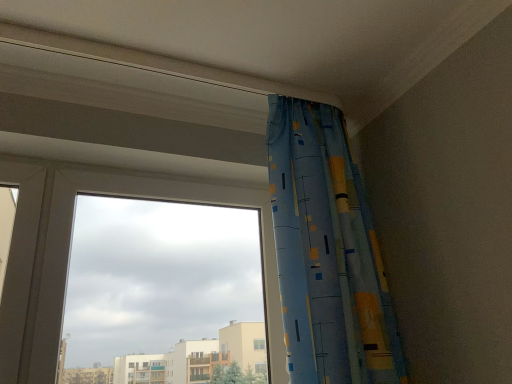
Question: Is blue printed fabric curtain at upper right further to camera compared to transparent glass window at upper left?

Choices:
 (A) no
 (B) yes

Answer: (A)

Question: Does blue printed fabric curtain at upper right have a smaller size compared to transparent glass window at upper left?

Choices:
 (A) yes
 (B) no

Answer: (B)

Question: Is blue printed fabric curtain at upper right oriented away from transparent glass window at upper left?

Choices:
 (A) no
 (B) yes

Answer: (A)

Question: Is transparent glass window at upper left inside blue printed fabric curtain at upper right?

Choices:
 (A) no
 (B) yes

Answer: (A)

Question: Does blue printed fabric curtain at upper right turn towards transparent glass window at upper left?

Choices:
 (A) yes
 (B) no

Answer: (B)

Question: Can you confirm if blue printed fabric curtain at upper right is taller than transparent glass window at upper left?

Choices:
 (A) yes
 (B) no

Answer: (A)

Question: Can you confirm if transparent glass window at upper left is bigger than blue printed fabric curtain at upper right?

Choices:
 (A) no
 (B) yes

Answer: (A)

Question: Would you say transparent glass window at upper left is outside blue printed fabric curtain at upper right?

Choices:
 (A) no
 (B) yes

Answer: (B)

Question: Considering the relative sizes of transparent glass window at upper left and blue printed fabric curtain at upper right in the image provided, is transparent glass window at upper left thinner than blue printed fabric curtain at upper right?

Choices:
 (A) no
 (B) yes

Answer: (B)

Question: Could you tell me if transparent glass window at upper left is facing blue printed fabric curtain at upper right?

Choices:
 (A) yes
 (B) no

Answer: (A)

Question: Is transparent glass window at upper left to the right of blue printed fabric curtain at upper right from the viewer's perspective?

Choices:
 (A) yes
 (B) no

Answer: (B)

Question: Does transparent glass window at upper left have a greater height compared to blue printed fabric curtain at upper right?

Choices:
 (A) yes
 (B) no

Answer: (B)

Question: From their relative heights in the image, would you say transparent glass window at upper left is taller or shorter than blue printed fabric curtain at upper right?

Choices:
 (A) short
 (B) tall

Answer: (A)